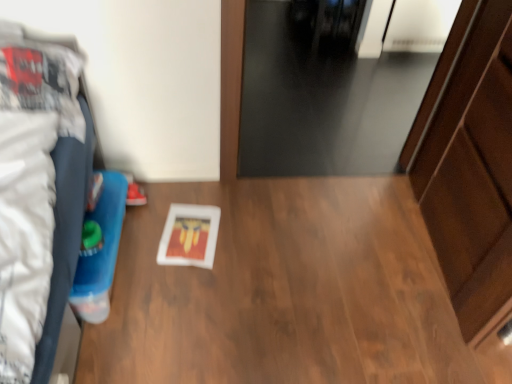
Locate an element on the screen. vacant area that lies between matte red shoe at lower left and wooden dresser at right is located at coordinates (312, 232).